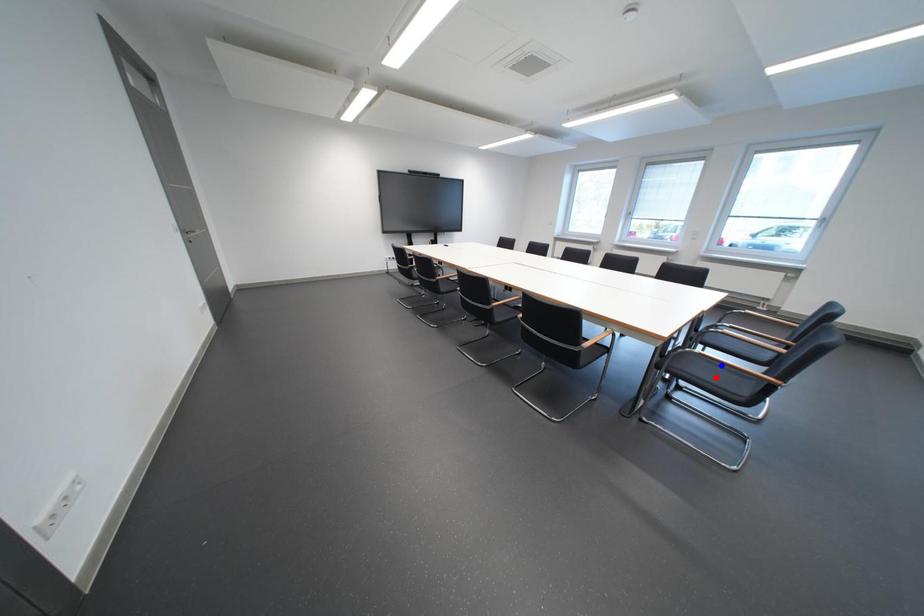
Question: Which of the two points in the image is closer to the camera?

Choices:
 (A) Blue point is closer.
 (B) Red point is closer.

Answer: (B)